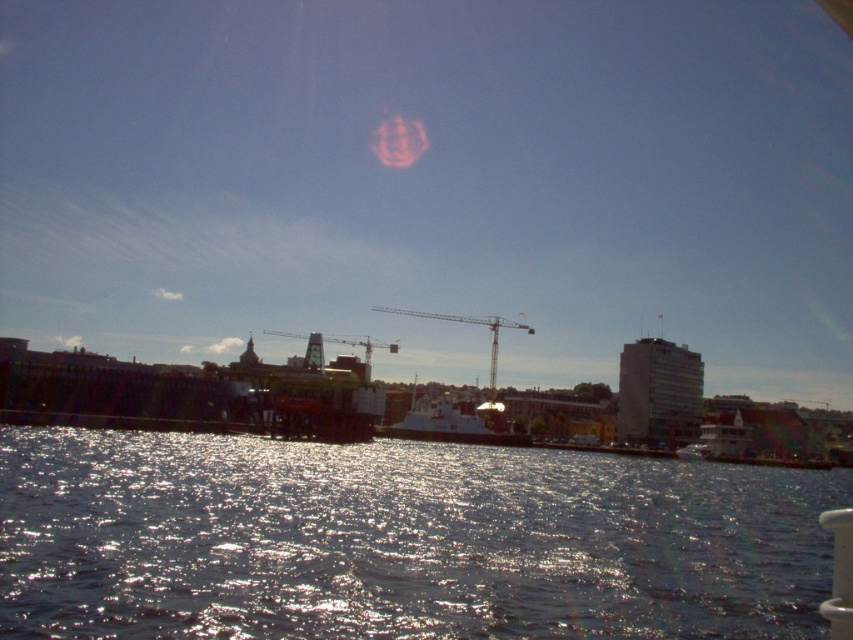
Who is more forward, [366,634] or [433,314]?

Point [366,634]

Identify the location of glistening water at center. The height and width of the screenshot is (640, 853). (399, 540).

Does white matte boat at center have a smaller size compared to metallic construction crane at center?

Indeed, white matte boat at center has a smaller size compared to metallic construction crane at center.

Consider the image. Between white matte boat at center and metallic construction crane at center, which one has less height?

white matte boat at center

Is point (479, 417) less distant than point (397, 340)?

Yes, point (479, 417) is in front of point (397, 340).

Where is `white matte boat at center`? white matte boat at center is located at coordinates (453, 422).

Based on the photo, is glistening water at center in front of white matte boat at center?

Yes.

In the scene shown: Is glistening water at center to the left of white matte boat at center from the viewer's perspective?

Yes, glistening water at center is to the left of white matte boat at center.

Is point (724, 483) farther from camera compared to point (497, 419)?

No, it is not.

The image size is (853, 640). Identify the location of glistening water at center. (399, 540).